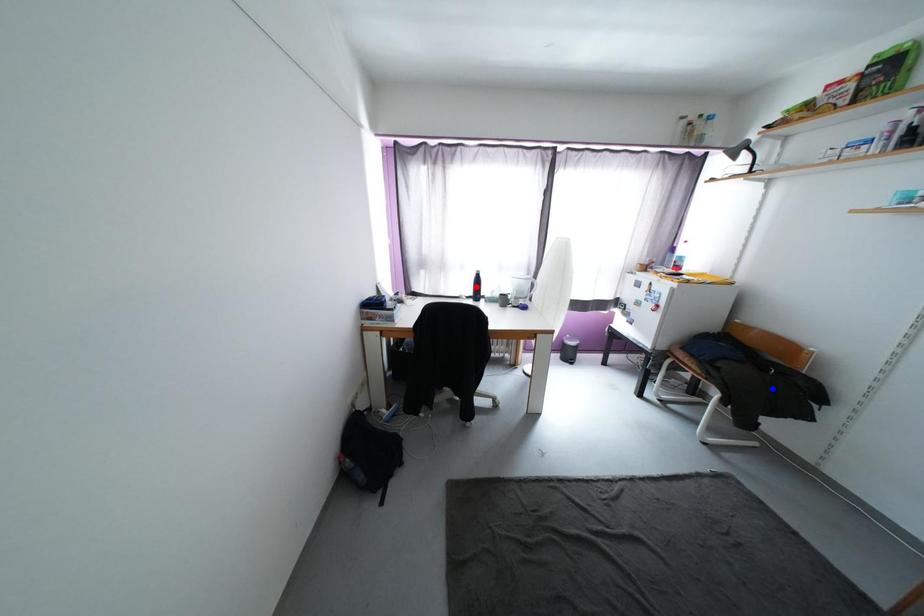
Question: Which of the two points in the image is closer to the camera?

Choices:
 (A) Blue point is closer.
 (B) Red point is closer.

Answer: (A)